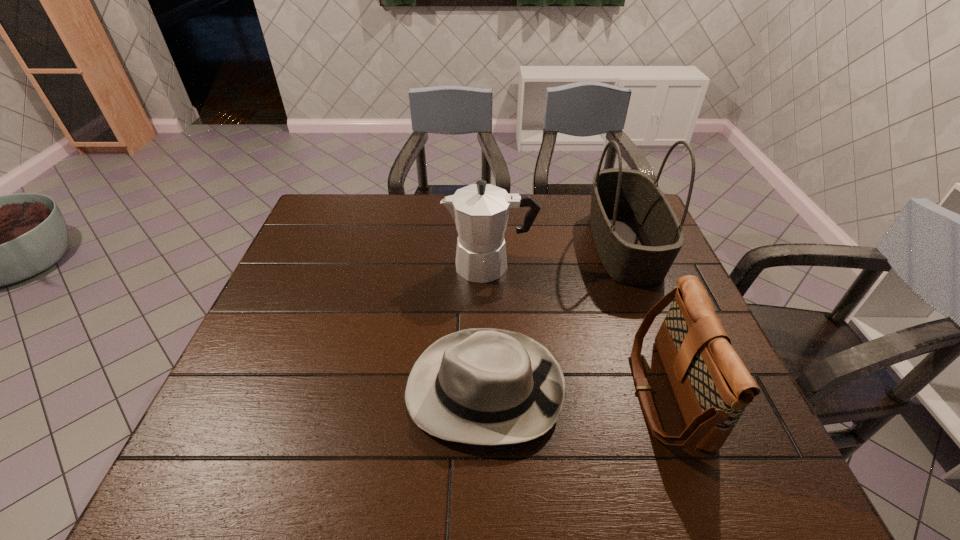
I want to click on object that stands as the closest to the coffeepot, so click(x=637, y=235).

Where is `object that is the closest to the second tallest object`? This screenshot has width=960, height=540. object that is the closest to the second tallest object is located at coordinates (637, 235).